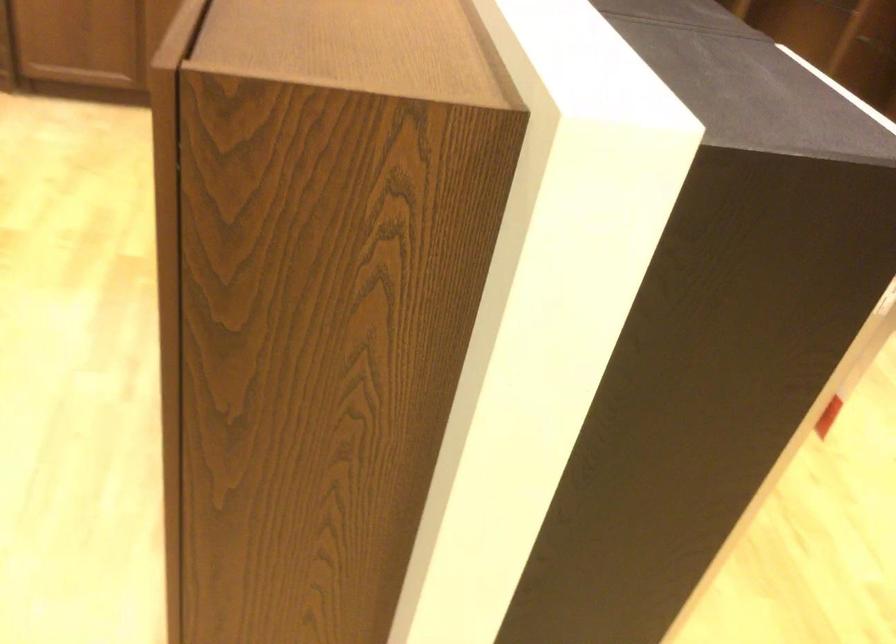
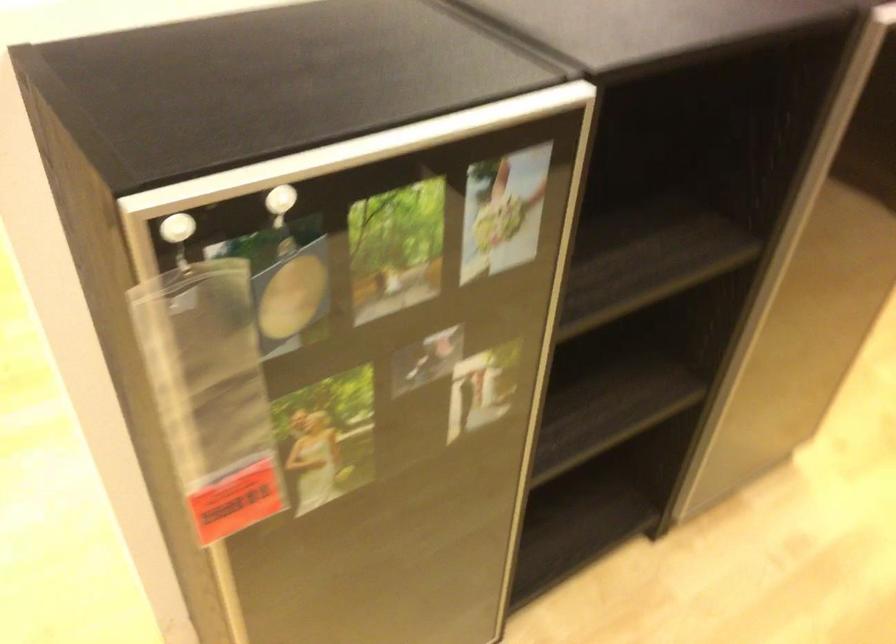
In the second image, find the point that corresponds to (x=807, y=98) in the first image.

(356, 152)